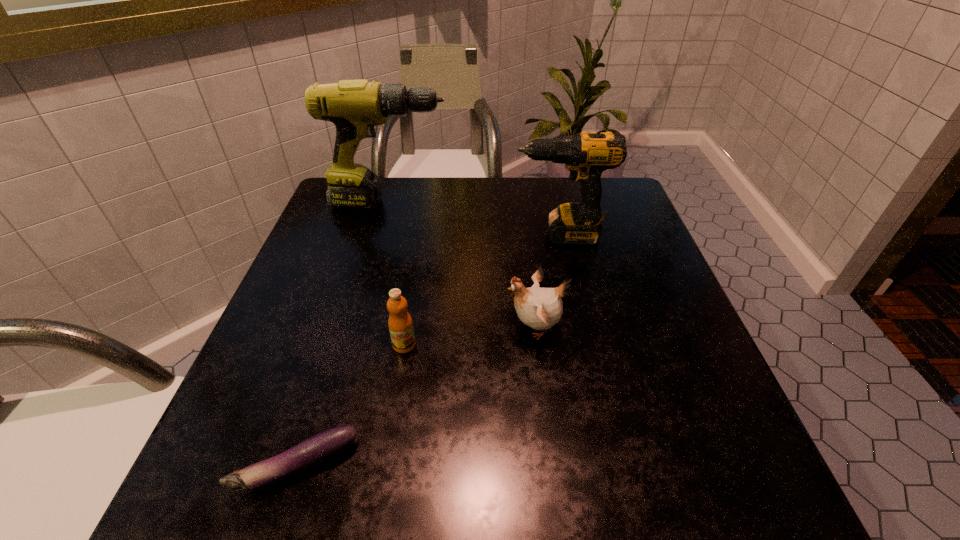
Locate an element on the screen. This screenshot has height=540, width=960. the farther drill is located at coordinates (355, 107).

At what (x,y) coordinates should I click in order to perform the action: click on the taller drill. Please return your answer as a coordinate pair (x, y). The height and width of the screenshot is (540, 960). Looking at the image, I should click on (355, 107).

You are a GUI agent. You are given a task and a screenshot of the screen. Output one action in this format:
    pyautogui.click(x=<x>, y=<y>)
    Task: Click on the shorter drill
    
    Given the screenshot: What is the action you would take?
    pyautogui.click(x=586, y=155)

Image resolution: width=960 pixels, height=540 pixels. I want to click on the right drill, so click(x=586, y=155).

This screenshot has width=960, height=540. Identify the location of orange juice. (400, 324).

The width and height of the screenshot is (960, 540). I want to click on bird, so click(x=540, y=308).

Identify the location of eggplant. This screenshot has height=540, width=960. (321, 447).

Find the location of `the shortest object`. the shortest object is located at coordinates 321,447.

This screenshot has width=960, height=540. I want to click on free spot located 0.270m on the handle side of the farther drill, so click(553, 203).

Where is `vacant space situated 0.070m at the tip of the right drill`? vacant space situated 0.070m at the tip of the right drill is located at coordinates (484, 235).